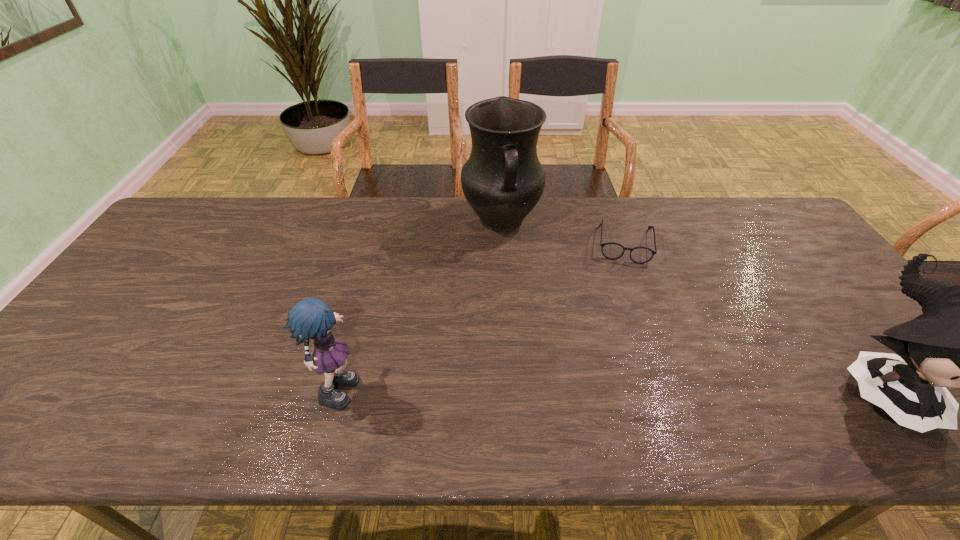
Find the location of a particular element. The height and width of the screenshot is (540, 960). vacant area situated on the handle side of the pitcher is located at coordinates (528, 347).

Where is `free spot located 0.080m on the handle side of the pitcher`? The width and height of the screenshot is (960, 540). free spot located 0.080m on the handle side of the pitcher is located at coordinates (511, 266).

Image resolution: width=960 pixels, height=540 pixels. Identify the location of spectacles that is at the far edge. (640, 255).

You are a GUI agent. You are given a task and a screenshot of the screen. Output one action in this format:
    pyautogui.click(x=<x>, y=<y>)
    Task: Click on the pitcher that is positioned at the far edge
    This screenshot has width=960, height=540.
    Given the screenshot: What is the action you would take?
    pyautogui.click(x=503, y=179)

Locate an element on the screen. Image resolution: width=960 pixels, height=540 pixels. object that is at the near edge is located at coordinates (310, 319).

The width and height of the screenshot is (960, 540). What are the coordinates of `free space at the far edge of the desktop` in the screenshot? It's located at (688, 240).

You are a GUI agent. You are given a task and a screenshot of the screen. Output one action in this format:
    pyautogui.click(x=<x>, y=<y>)
    Task: Click on the free spot at the near edge of the desktop
    The height and width of the screenshot is (540, 960).
    Given the screenshot: What is the action you would take?
    pyautogui.click(x=746, y=402)

Where is `free region at the left edge of the desktop`? Image resolution: width=960 pixels, height=540 pixels. free region at the left edge of the desktop is located at coordinates (136, 269).

The image size is (960, 540). In the image, there is a desktop. Identify the location of vacant region at the right edge. (785, 255).

Identify the location of free region at the far left corner. (182, 214).